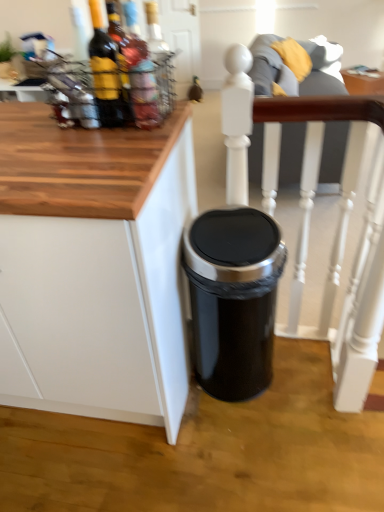
Image resolution: width=384 pixels, height=512 pixels. In order to click on matte glass bottle at upper left, positioned as the 1th bottle in left-to-right order in this screenshot , I will do `click(105, 72)`.

What do you see at coordinates (105, 72) in the screenshot? The width and height of the screenshot is (384, 512). I see `matte glass bottle at upper left, positioned as the 3th bottle in right-to-left order` at bounding box center [105, 72].

Describe the element at coordinates (233, 298) in the screenshot. I see `black metallic trash can at center` at that location.

This screenshot has width=384, height=512. Describe the element at coordinates (318, 162) in the screenshot. I see `white painted wood chair at center` at that location.

What is the approximate height of white painted wood chair at center?

1.21 meters.

You are a GUI agent. You are given a task and a screenshot of the screen. Output one action in this format:
    pyautogui.click(x=<x>, y=<y>)
    Task: Click on the matte glass bottle at upper left, positioned as the 1th bottle in left-to-right order
    The width and height of the screenshot is (384, 512).
    Given the screenshot: What is the action you would take?
    pyautogui.click(x=105, y=72)

Does point (195, 229) come in front of point (108, 47)?

That is False.

Would you say matte glass bottle at upper left, positioned as the 3th bottle in right-to-left order, is part of black metallic trash can at center's contents?

No, black metallic trash can at center does not contain matte glass bottle at upper left, positioned as the 3th bottle in right-to-left order.

Image resolution: width=384 pixels, height=512 pixels. I want to click on the 2nd bottle in front of the black metallic trash can at center, so click(x=105, y=72).

Would you say white matte cabinet at lower right is part of matte glass bottle at upper left, positioned as the 3th bottle in right-to-left order,'s contents?

No, matte glass bottle at upper left, positioned as the 3th bottle in right-to-left order, does not contain white matte cabinet at lower right.

Can you confirm if matte glass bottle at upper left, positioned as the 1th bottle in left-to-right order, is positioned to the left of white matte cabinet at lower right?

In fact, matte glass bottle at upper left, positioned as the 1th bottle in left-to-right order, is to the right of white matte cabinet at lower right.

There is a white matte cabinet at lower right. Where is `the 3rd bottle above it (from a real-world perspective)`? This screenshot has width=384, height=512. the 3rd bottle above it (from a real-world perspective) is located at coordinates (105, 72).

From a real-world perspective, which is physically below, matte glass bottle at upper left, positioned as the 3th bottle in right-to-left order, or white matte cabinet at lower right?

In real-world perspective, white matte cabinet at lower right is lower.

Can you confirm if matte glass bottle at upper left, which is the 2th bottle in right-to-left order, is wider than white matte cabinet at lower right?

No.

Relative to white matte cabinet at lower right, is matte glass bottle at upper left, which is the second bottle from left to right, in front or behind?

In the image, matte glass bottle at upper left, which is the second bottle from left to right, appears behind white matte cabinet at lower right.

Is matte glass bottle at upper left, which is the 2th bottle in right-to-left order, looking in the opposite direction of white matte cabinet at lower right?

No, matte glass bottle at upper left, which is the 2th bottle in right-to-left order, is not facing the opposite direction of white matte cabinet at lower right.

How different are the orientations of matte glass bottle at upper left, which is the 2th bottle in right-to-left order, and white matte cabinet at lower right in degrees?

The angle between the facing direction of matte glass bottle at upper left, which is the 2th bottle in right-to-left order, and the facing direction of white matte cabinet at lower right is 180 degrees.

Locate an element on the screen. bottle lying above the matte glass bottle at upper left, positioned as the 3th bottle in right-to-left order (from the image's perspective) is located at coordinates (159, 59).

Can you confirm if translucent glass bottle at upper left, which ranks as the 1th bottle in right-to-left order, is thinner than matte glass bottle at upper left, positioned as the 1th bottle in left-to-right order?

Indeed, translucent glass bottle at upper left, which ranks as the 1th bottle in right-to-left order, has a lesser width compared to matte glass bottle at upper left, positioned as the 1th bottle in left-to-right order.

From a real-world perspective, is translucent glass bottle at upper left, which ranks as the 1th bottle in right-to-left order, on top of matte glass bottle at upper left, positioned as the 3th bottle in right-to-left order?

Incorrect, from a real-world perspective, translucent glass bottle at upper left, which ranks as the 1th bottle in right-to-left order, is lower than matte glass bottle at upper left, positioned as the 3th bottle in right-to-left order.

From the image's perspective, is translucent glass bottle at upper left, which is the third bottle in left-to-right order, located beneath matte glass bottle at upper left, positioned as the 3th bottle in right-to-left order?

No, from the image's perspective, translucent glass bottle at upper left, which is the third bottle in left-to-right order, is not below matte glass bottle at upper left, positioned as the 3th bottle in right-to-left order.

From the image's perspective, is white painted wood chair at center on matte glass bottle at upper left, which is the second bottle from left to right?

Incorrect, from the image's perspective, white painted wood chair at center is lower than matte glass bottle at upper left, which is the second bottle from left to right.

From a real-world perspective, between white painted wood chair at center and matte glass bottle at upper left, which is the second bottle from left to right, who is vertically lower?

white painted wood chair at center, from a real-world perspective.

Which is less distant, (362, 255) or (145, 127)?

The point (145, 127) is closer.

Which of these two, white matte cabinet at lower right or white painted wood chair at center, stands shorter?

With less height is white matte cabinet at lower right.

Is white matte cabinet at lower right facing towards white painted wood chair at center?

No, white matte cabinet at lower right is not aimed at white painted wood chair at center.

Based on their sizes in the image, would you say white matte cabinet at lower right is bigger or smaller than white painted wood chair at center?

Considering their sizes, white matte cabinet at lower right takes up more space than white painted wood chair at center.

Is matte glass bottle at upper left, positioned as the 3th bottle in right-to-left order, surrounding translucent glass bottle at upper left, which ranks as the 1th bottle in right-to-left order?

Definitely not — translucent glass bottle at upper left, which ranks as the 1th bottle in right-to-left order, is not inside matte glass bottle at upper left, positioned as the 3th bottle in right-to-left order.

Does point (114, 54) come farther from viewer compared to point (172, 106)?

No, it is in front of (172, 106).

Which of these two, matte glass bottle at upper left, positioned as the 3th bottle in right-to-left order, or translucent glass bottle at upper left, which is the third bottle in left-to-right order, is bigger?

With larger size is matte glass bottle at upper left, positioned as the 3th bottle in right-to-left order.

Is matte glass bottle at upper left, positioned as the 1th bottle in left-to-right order, far from translucent glass bottle at upper left, which is the third bottle in left-to-right order?

matte glass bottle at upper left, positioned as the 1th bottle in left-to-right order, is near translucent glass bottle at upper left, which is the third bottle in left-to-right order, not far away.

The image size is (384, 512). Identify the location of waste container below the matte glass bottle at upper left, positioned as the 1th bottle in left-to-right order (from a real-world perspective). (233, 298).

I want to click on cabinetry below the matte glass bottle at upper left, positioned as the 3th bottle in right-to-left order (from the image's perspective), so click(94, 266).

Which object lies nearer to the anchor point white matte cabinet at lower right, white painted wood chair at center or translucent glass bottle at upper left, which ranks as the 1th bottle in right-to-left order?

translucent glass bottle at upper left, which ranks as the 1th bottle in right-to-left order, is positioned closer to the anchor white matte cabinet at lower right.

Looking at the image, which one is located closer to matte glass bottle at upper left, which is the second bottle from left to right, translucent glass bottle at upper left, which ranks as the 1th bottle in right-to-left order, or black metallic trash can at center?

Based on the image, translucent glass bottle at upper left, which ranks as the 1th bottle in right-to-left order, appears to be nearer to matte glass bottle at upper left, which is the second bottle from left to right.

Looking at the image, which one is located further to matte glass bottle at upper left, positioned as the 3th bottle in right-to-left order, black metallic trash can at center or translucent glass bottle at upper left, which ranks as the 1th bottle in right-to-left order?

black metallic trash can at center is further to matte glass bottle at upper left, positioned as the 3th bottle in right-to-left order.

From the image, which object appears to be farther from matte glass bottle at upper left, positioned as the 3th bottle in right-to-left order, black metallic trash can at center or matte glass bottle at upper left, which is the 2th bottle in right-to-left order?

black metallic trash can at center lies further to matte glass bottle at upper left, positioned as the 3th bottle in right-to-left order, than the other object.

Based on their spatial positions, is black metallic trash can at center or white matte cabinet at lower right closer to translucent glass bottle at upper left, which is the third bottle in left-to-right order?

white matte cabinet at lower right lies closer to translucent glass bottle at upper left, which is the third bottle in left-to-right order, than the other object.

Which object lies further to the anchor point white painted wood chair at center, matte glass bottle at upper left, positioned as the 3th bottle in right-to-left order, or matte glass bottle at upper left, which is the second bottle from left to right?

matte glass bottle at upper left, positioned as the 3th bottle in right-to-left order, is positioned further to the anchor white painted wood chair at center.

From the image, which object appears to be nearer to white matte cabinet at lower right, matte glass bottle at upper left, which is the second bottle from left to right, or matte glass bottle at upper left, positioned as the 1th bottle in left-to-right order?

matte glass bottle at upper left, positioned as the 1th bottle in left-to-right order, lies closer to white matte cabinet at lower right than the other object.

Estimate the real-world distances between objects in this image. Which object is closer to translucent glass bottle at upper left, which ranks as the 1th bottle in right-to-left order, white matte cabinet at lower right or matte glass bottle at upper left, positioned as the 1th bottle in left-to-right order?

The object closer to translucent glass bottle at upper left, which ranks as the 1th bottle in right-to-left order, is matte glass bottle at upper left, positioned as the 1th bottle in left-to-right order.

At what (x,y) coordinates should I click in order to perform the action: click on chair between translucent glass bottle at upper left, which is the third bottle in left-to-right order, and black metallic trash can at center from top to bottom. Please return your answer as a coordinate pair (x, y). Looking at the image, I should click on (318, 162).

Locate an element on the screen. The height and width of the screenshot is (512, 384). bottle between matte glass bottle at upper left, positioned as the 3th bottle in right-to-left order, and translucent glass bottle at upper left, which ranks as the 1th bottle in right-to-left order, in the horizontal direction is located at coordinates (140, 73).

Image resolution: width=384 pixels, height=512 pixels. I want to click on cabinetry that lies between matte glass bottle at upper left, positioned as the 3th bottle in right-to-left order, and black metallic trash can at center from top to bottom, so click(x=94, y=266).

Find the location of a particular element. Image resolution: width=384 pixels, height=512 pixels. chair that lies between matte glass bottle at upper left, which is the 2th bottle in right-to-left order, and black metallic trash can at center from top to bottom is located at coordinates (318, 162).